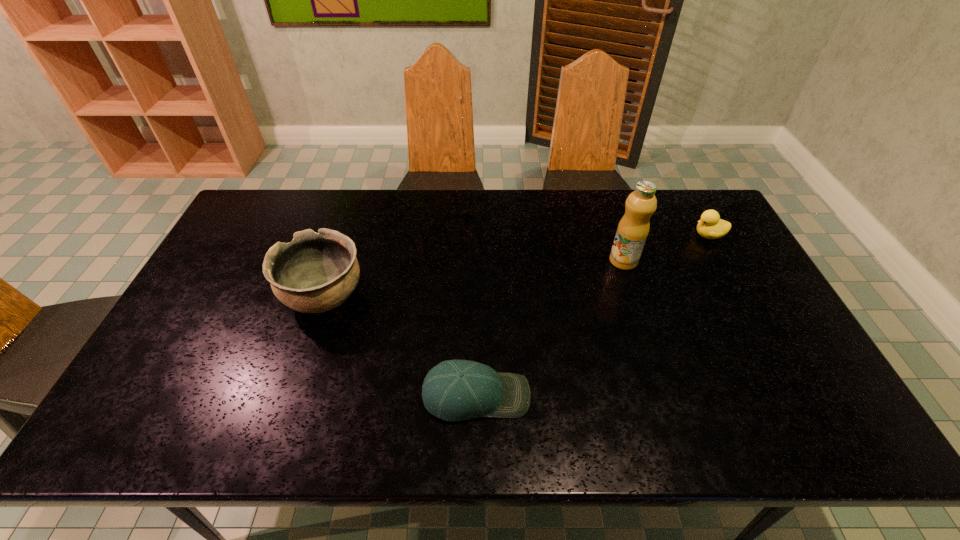
This screenshot has height=540, width=960. In the image, there is a desktop. Identify the location of blank space at the left edge. (197, 301).

In the image, there is a desktop. Where is `free space at the right edge`? The width and height of the screenshot is (960, 540). free space at the right edge is located at coordinates (685, 234).

In the image, there is a desktop. Where is `vacant space at the near left corner`? The width and height of the screenshot is (960, 540). vacant space at the near left corner is located at coordinates (171, 431).

Identify the location of vacant space at the near right corner of the desktop. (839, 446).

The image size is (960, 540). In order to click on free area in between the farthest object and the baseball cap in this screenshot , I will do `click(592, 315)`.

Where is `free space between the duck and the tallest object`? Image resolution: width=960 pixels, height=540 pixels. free space between the duck and the tallest object is located at coordinates (666, 248).

Locate an element on the screen. empty location between the fruit juice and the leftmost object is located at coordinates (474, 279).

What are the coordinates of `empty location between the tallest object and the baseball cap` in the screenshot? It's located at (550, 328).

Where is `vacant space that's between the duck and the pottery`? vacant space that's between the duck and the pottery is located at coordinates (516, 266).

At what (x,y) coordinates should I click in order to perform the action: click on vacant area between the nearest object and the duck. Please return your answer as a coordinate pair (x, y). Looking at the image, I should click on (592, 315).